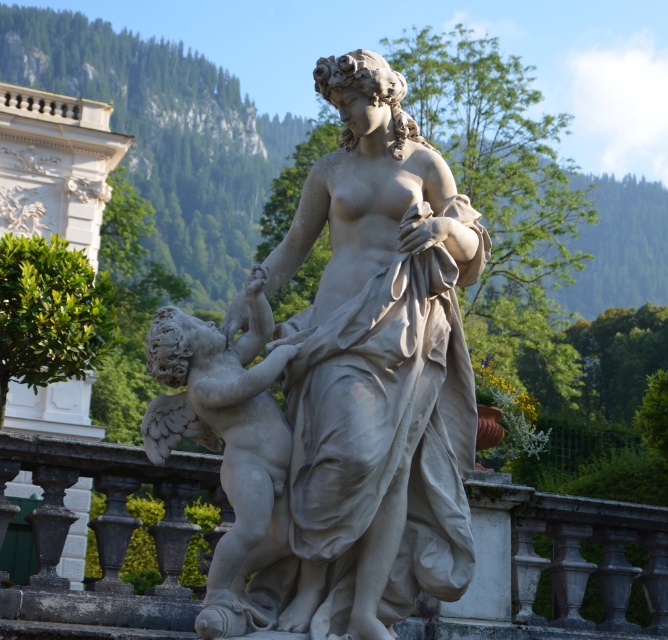
Who is shorter, white marble statue at center or white marble cherub at center?

white marble cherub at center is shorter.

The height and width of the screenshot is (640, 668). I want to click on white marble statue at center, so click(x=375, y=371).

From the picture: Is white marble statue at center positioned behind white stone railing at center?

No, it is not.

Can you confirm if white marble statue at center is positioned above white stone railing at center?

Yes, white marble statue at center is above white stone railing at center.

Which is behind, point (349, 435) or point (220, 516)?

The point (220, 516) is behind.

At what (x,y) coordinates should I click in order to perform the action: click on white marble statue at center. Please return your answer as a coordinate pair (x, y). The image size is (668, 640). Looking at the image, I should click on (375, 371).

This screenshot has width=668, height=640. I want to click on white stone railing at center, so click(x=552, y=566).

Between white stone railing at center and white marble cherub at center, which one appears on the left side from the viewer's perspective?

white marble cherub at center

Is point (522, 584) farther from viewer compared to point (271, 452)?

Yes.

Locate an element on the screen. white stone railing at center is located at coordinates (552, 566).